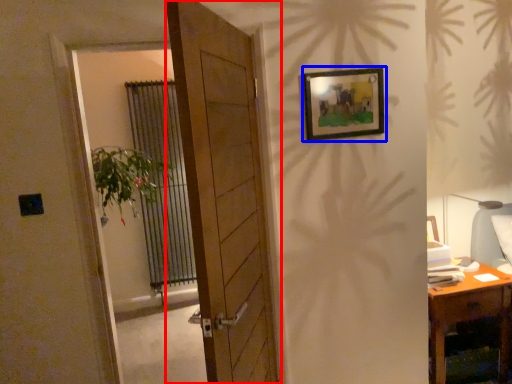
Question: Which point is closer to the camera, door (highlighted by a red box) or picture frame (highlighted by a blue box)?

Choices:
 (A) door
 (B) picture frame

Answer: (A)